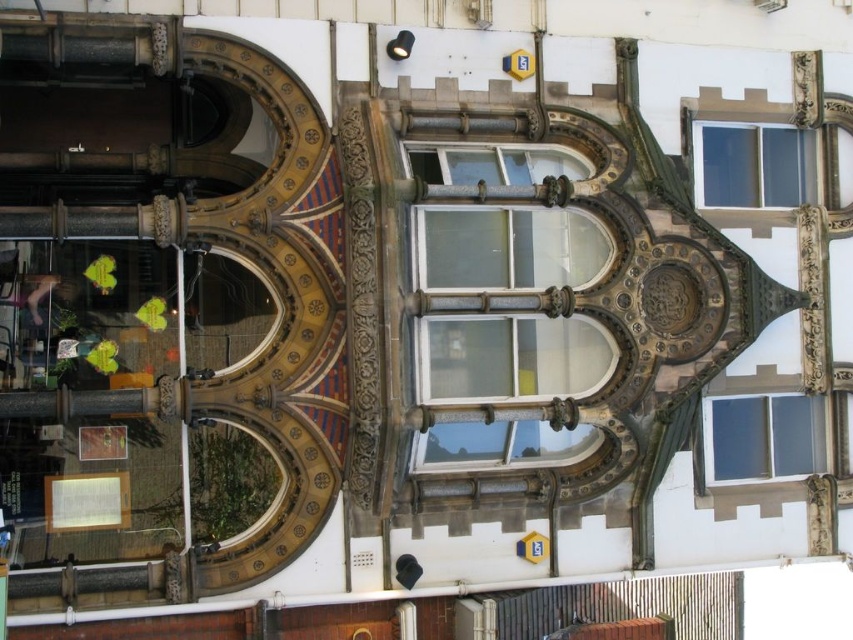
Which is more to the left, clear glass window at center or clear glass window at upper right?

Positioned to the left is clear glass window at center.

Can you confirm if clear glass window at center is positioned above clear glass window at upper right?

Yes.

Does point (450, 333) lie in front of point (817, 417)?

Yes, point (450, 333) is closer to viewer.

Locate an element on the screen. clear glass window at center is located at coordinates (506, 246).

Is clear glass window at upper center above clear glass window at upper right?

Yes.

Between clear glass window at upper center and clear glass window at upper right, which one appears on the left side from the viewer's perspective?

Positioned to the left is clear glass window at upper right.

This screenshot has width=853, height=640. Describe the element at coordinates (755, 164) in the screenshot. I see `clear glass window at upper center` at that location.

The width and height of the screenshot is (853, 640). In order to click on clear glass window at upper center in this screenshot , I will do `click(755, 164)`.

The image size is (853, 640). Describe the element at coordinates (506, 246) in the screenshot. I see `clear glass window at center` at that location.

Can you confirm if clear glass window at center is positioned below clear glass window at upper center?

Yes.

Does point (445, 262) come behind point (772, 152)?

No, (445, 262) is in front of (772, 152).

Where is `clear glass window at center`? This screenshot has width=853, height=640. clear glass window at center is located at coordinates (506, 246).